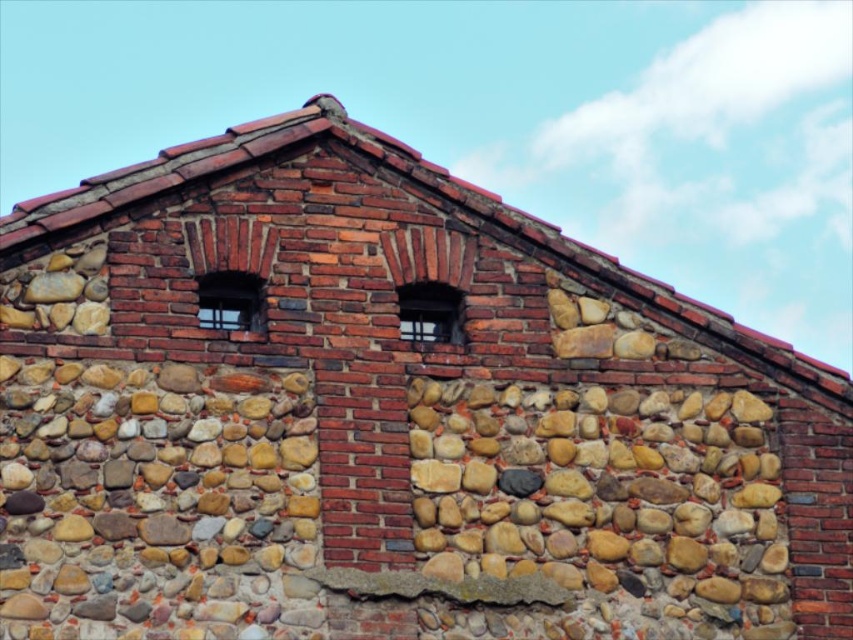
Does matte glass window at center appear over clear glass window at upper center?

Incorrect, matte glass window at center is not positioned above clear glass window at upper center.

Describe the element at coordinates (430, 312) in the screenshot. I see `matte glass window at center` at that location.

The image size is (853, 640). What are the coordinates of `matte glass window at center` in the screenshot? It's located at (430, 312).